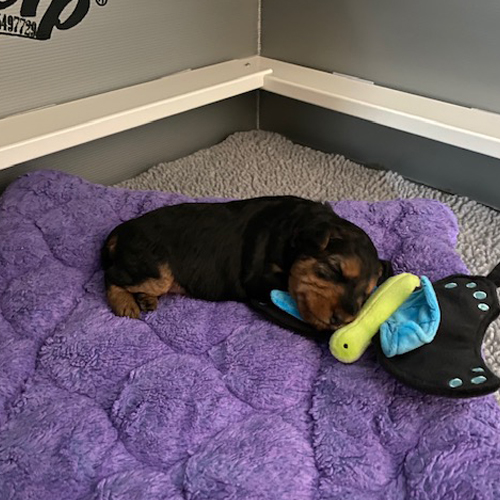
Locate an element on the screen. Image resolution: width=500 pixels, height=500 pixels. bed behind dog is located at coordinates (80, 241).